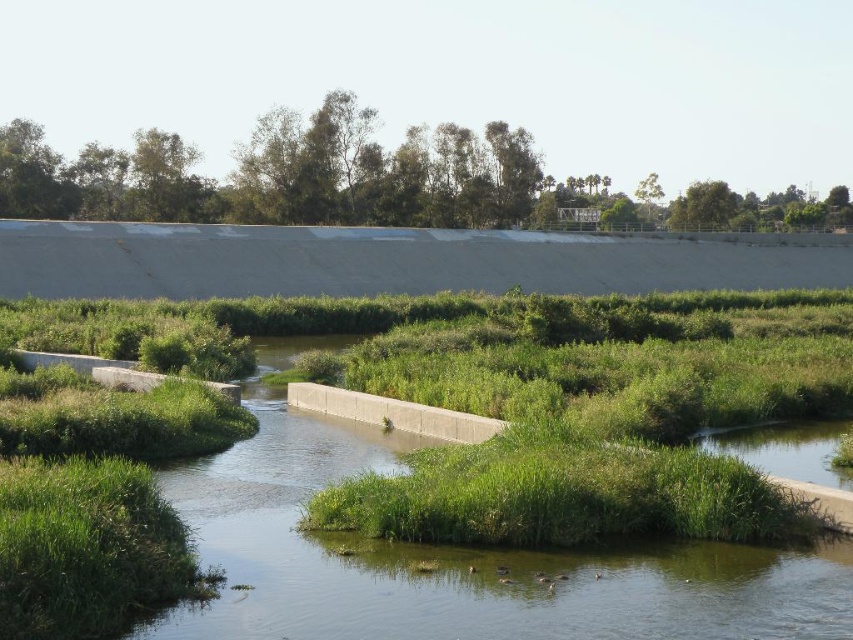
Question: Among these objects, which one is farthest from the camera?

Choices:
 (A) green leafy trees at upper center
 (B) green grassy river at center

Answer: (A)

Question: Can you confirm if green grassy river at center is positioned below green leafy trees at upper center?

Choices:
 (A) yes
 (B) no

Answer: (A)

Question: Which of the following is the closest to the observer?

Choices:
 (A) green leafy trees at upper center
 (B) green grassy river at center

Answer: (B)

Question: Does green grassy river at center appear under green leafy trees at upper center?

Choices:
 (A) yes
 (B) no

Answer: (A)

Question: Can you confirm if green grassy river at center is positioned to the left of green leafy trees at upper center?

Choices:
 (A) yes
 (B) no

Answer: (B)